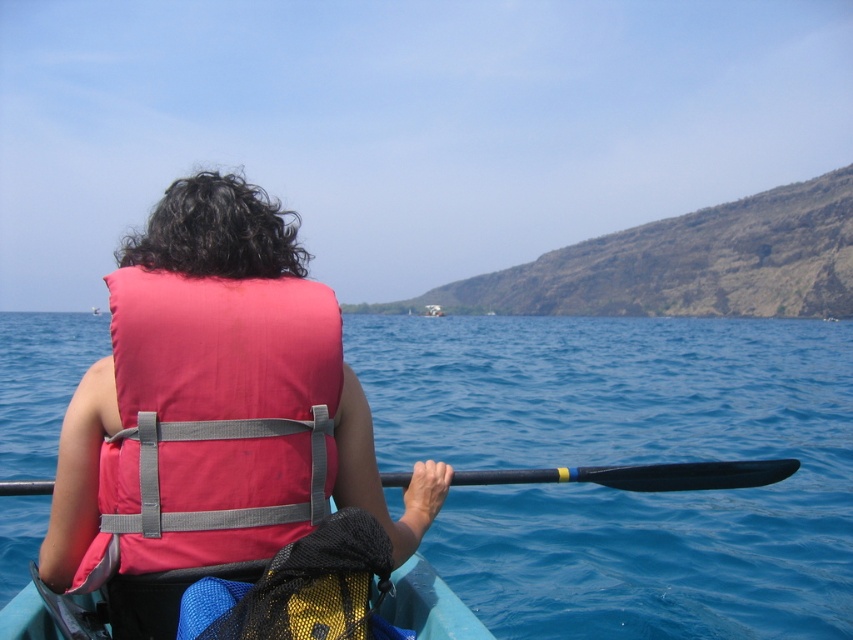
Does pink fabric life vest at center appear under black rubber paddle at center?

Incorrect, pink fabric life vest at center is not positioned below black rubber paddle at center.

Can you confirm if pink fabric life vest at center is thinner than black rubber paddle at center?

In fact, pink fabric life vest at center might be wider than black rubber paddle at center.

What are the coordinates of `pink fabric life vest at center` in the screenshot? It's located at (216, 401).

The width and height of the screenshot is (853, 640). Describe the element at coordinates (625, 461) in the screenshot. I see `blue water at center` at that location.

Who is more forward, [641,348] or [125,384]?

Point [125,384]

Is point (799, 404) positioned after point (171, 364)?

That is True.

Locate an element on the screen. blue water at center is located at coordinates (625, 461).

Is pink fabric life jacket at center bigger than black rubber paddle at center?

Correct, pink fabric life jacket at center is larger in size than black rubber paddle at center.

Does point (247, 492) lie in front of point (718, 481)?

That is True.

At what (x,y) coordinates should I click in order to perform the action: click on pink fabric life jacket at center. Please return your answer as a coordinate pair (x, y). The image size is (853, 640). Looking at the image, I should click on (213, 420).